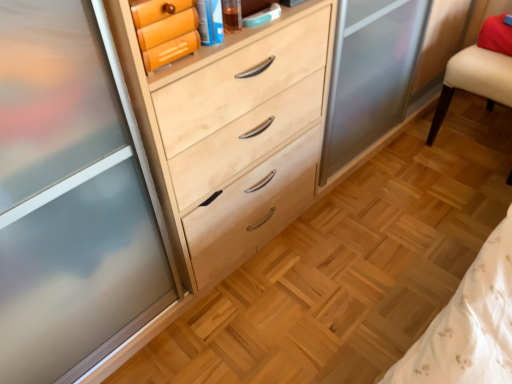
Find the location of a particular element. free space that is to the left of beige fabric chair at right is located at coordinates (415, 165).